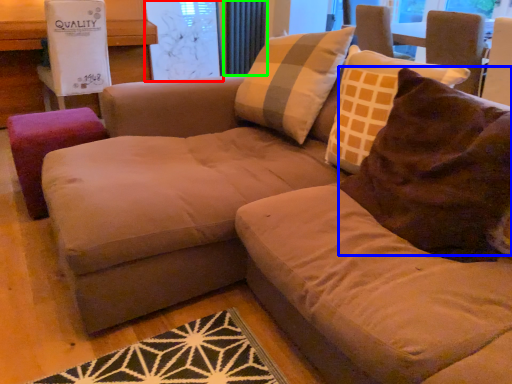
Question: Based on their relative distances, which object is nearer to window screen (highlighted by a red box)? Choose from throw pillow (highlighted by a blue box) and radiator (highlighted by a green box).

Choices:
 (A) throw pillow
 (B) radiator

Answer: (B)